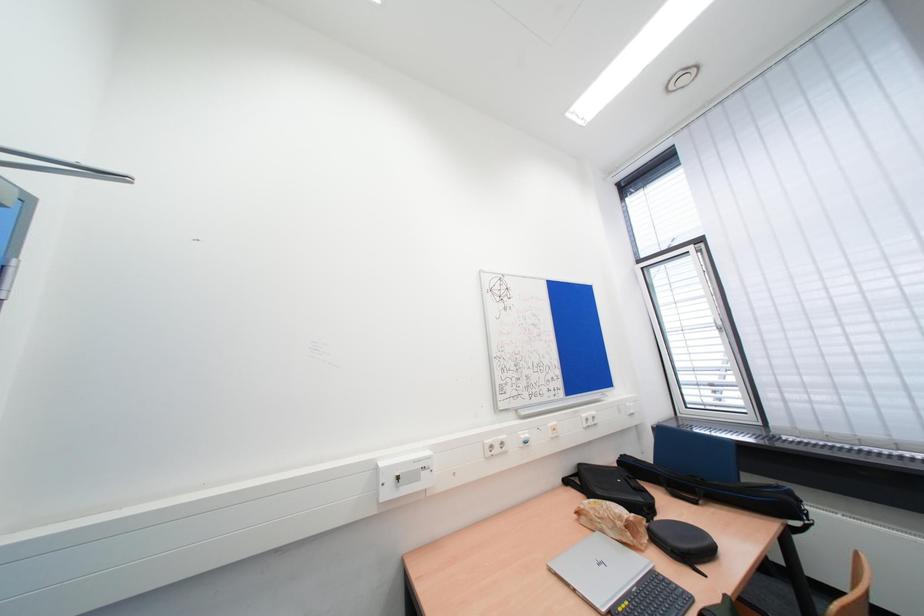
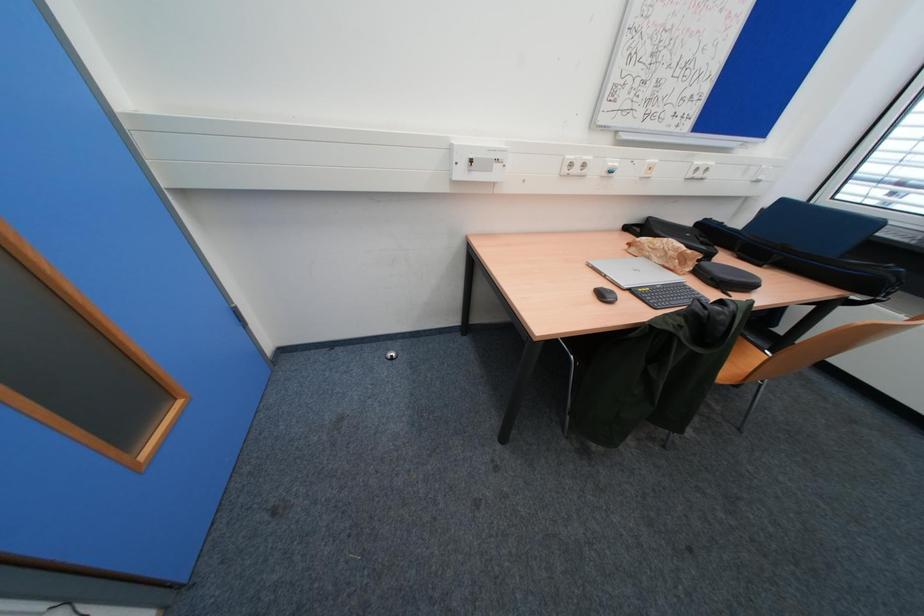
Question: The first image is from the beginning of the video and the second image is from the end. How did the camera likely rotate when shooting the video?

Choices:
 (A) Left
 (B) Right
 (C) Up
 (D) Down

Answer: (D)